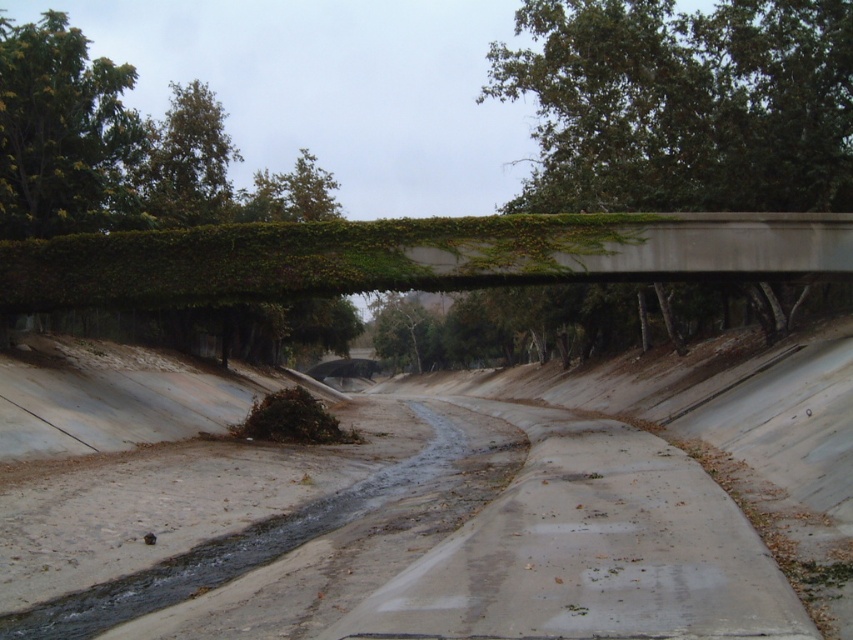
Can you confirm if dull concrete dirt track at center is positioned below green leafy tree at upper center?

Indeed, dull concrete dirt track at center is positioned under green leafy tree at upper center.

Who is taller, dull concrete dirt track at center or green leafy tree at upper center?

green leafy tree at upper center

Is point (532, 394) positioned before point (809, 173)?

No, it is not.

Image resolution: width=853 pixels, height=640 pixels. What are the coordinates of `dull concrete dirt track at center` in the screenshot? It's located at (451, 516).

What do you see at coordinates (683, 104) in the screenshot? I see `green leafy tree at upper center` at bounding box center [683, 104].

Consider the image. Who is positioned more to the left, green leafy tree at upper center or green ivy-covered concrete bridge at upper center?

green ivy-covered concrete bridge at upper center is more to the left.

Locate an element on the screen. This screenshot has width=853, height=640. green leafy tree at upper center is located at coordinates (683, 104).

Between point (299, 518) and point (189, 339), which one is positioned in front?

Positioned in front is point (299, 518).

Measure the distance between point (244, 636) and camera.

Point (244, 636) and camera are 7.20 meters apart from each other.

Between point (706, 632) and point (274, 305), which one is positioned in front?

Point (706, 632) is in front.

Find the location of a particular element. This screenshot has width=853, height=640. dull concrete dirt track at center is located at coordinates (451, 516).